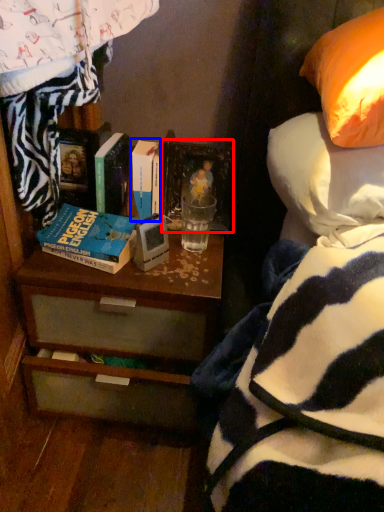
Question: Which object appears farthest to the camera in this image, picture frame (highlighted by a red box) or book (highlighted by a blue box)?

Choices:
 (A) picture frame
 (B) book

Answer: (A)